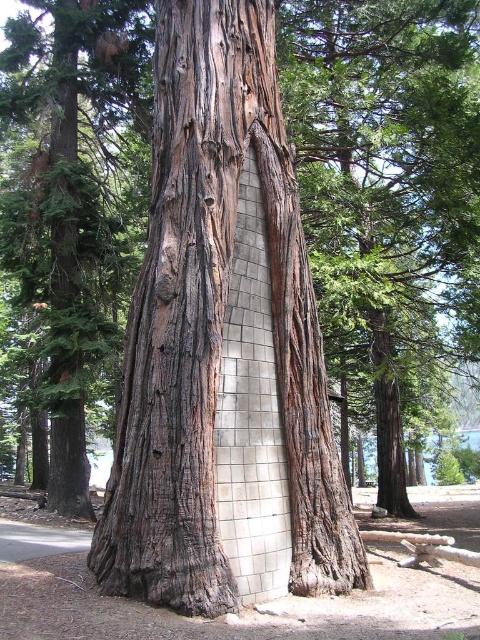
Is point (171, 604) farther from viewer compared to point (22, 17)?

No, (171, 604) is closer to viewer.

What do you see at coordinates (216, 330) in the screenshot?
I see `smooth bark tree trunk at center` at bounding box center [216, 330].

The height and width of the screenshot is (640, 480). I want to click on smooth bark tree trunk at center, so click(x=216, y=330).

You are a GUI agent. You are given a task and a screenshot of the screen. Output one action in this format:
    pyautogui.click(x=<x>, y=<y>)
    Task: Click on the smooth bark tree trunk at center
    
    Given the screenshot: What is the action you would take?
    pyautogui.click(x=216, y=330)